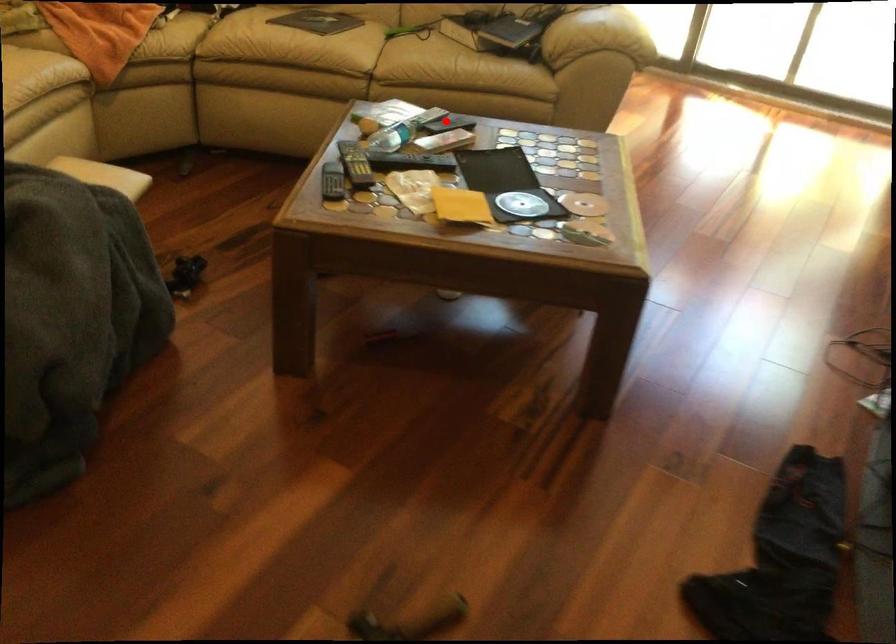
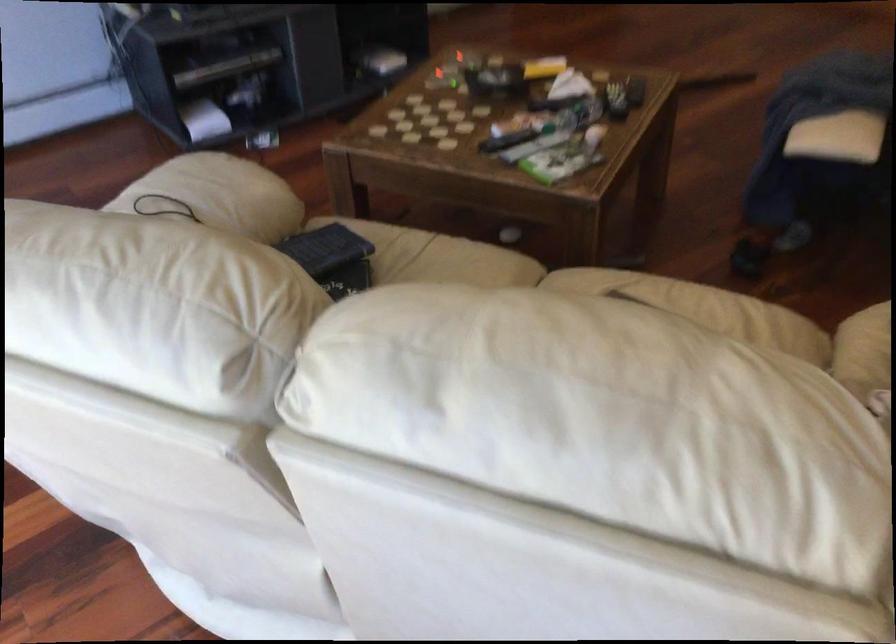
Locate, in the second image, the point that corresponds to the highlighted location in the first image.

(506, 140)